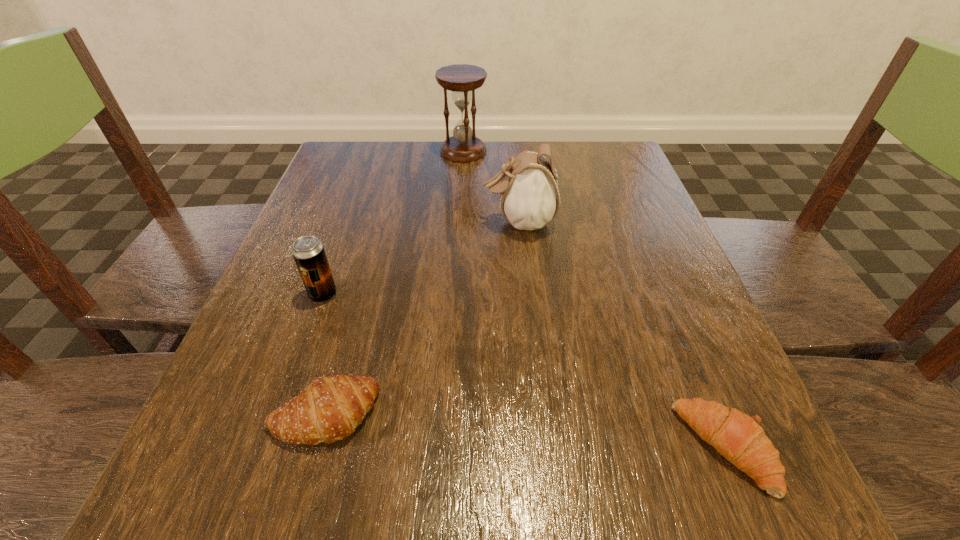
The height and width of the screenshot is (540, 960). I want to click on vacant point located between the third nearest object and the left crescent roll, so click(324, 354).

The width and height of the screenshot is (960, 540). What are the coordinates of `blank region between the second tallest object and the left crescent roll` in the screenshot? It's located at (421, 318).

This screenshot has height=540, width=960. Find the location of `empty location between the taller crescent roll and the second tallest object`. empty location between the taller crescent roll and the second tallest object is located at coordinates (421, 318).

What are the coordinates of `vacant area between the shorter crescent roll and the taller crescent roll` in the screenshot? It's located at (524, 431).

The width and height of the screenshot is (960, 540). Find the location of `free space that is in between the second tallest object and the taller crescent roll`. free space that is in between the second tallest object and the taller crescent roll is located at coordinates (x=421, y=318).

In order to click on vacant point located between the hourglass and the left crescent roll in this screenshot , I will do `click(394, 283)`.

Locate an element on the screen. The width and height of the screenshot is (960, 540). blank region between the second shortest object and the shorter crescent roll is located at coordinates (524, 431).

I want to click on free space between the taller crescent roll and the hourglass, so click(x=394, y=283).

This screenshot has width=960, height=540. In order to click on the fourth closest object relative to the right crescent roll in this screenshot , I will do 461,79.

You are a GUI agent. You are given a task and a screenshot of the screen. Output one action in this format:
    pyautogui.click(x=<x>, y=<y>)
    Task: Click on the object identified as the closest to the left crescent roll
    The width and height of the screenshot is (960, 540).
    Given the screenshot: What is the action you would take?
    pyautogui.click(x=308, y=252)